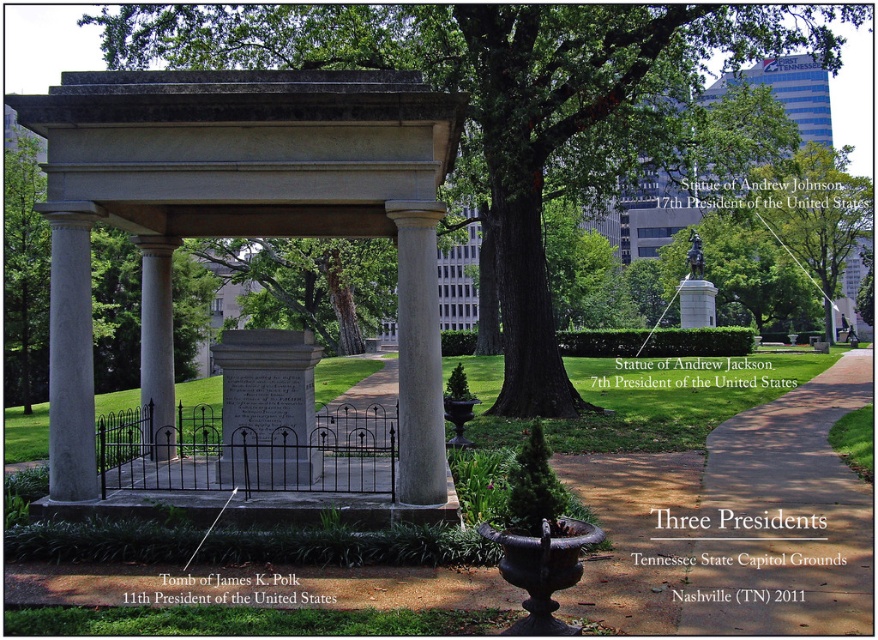
You are standing in front of the tomb at the Tennessee State Capitol Grounds. You notice two columns, the white marble column at center and the gray stone column at center. Which column is placed higher than the other?

The white marble column at center is positioned over gray stone column at center, so it is placed higher.